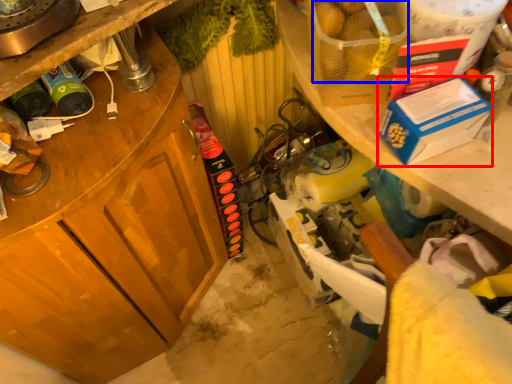
Question: Which point is closer to the camera, box (highlighted by a red box) or food (highlighted by a blue box)?

Choices:
 (A) box
 (B) food

Answer: (B)